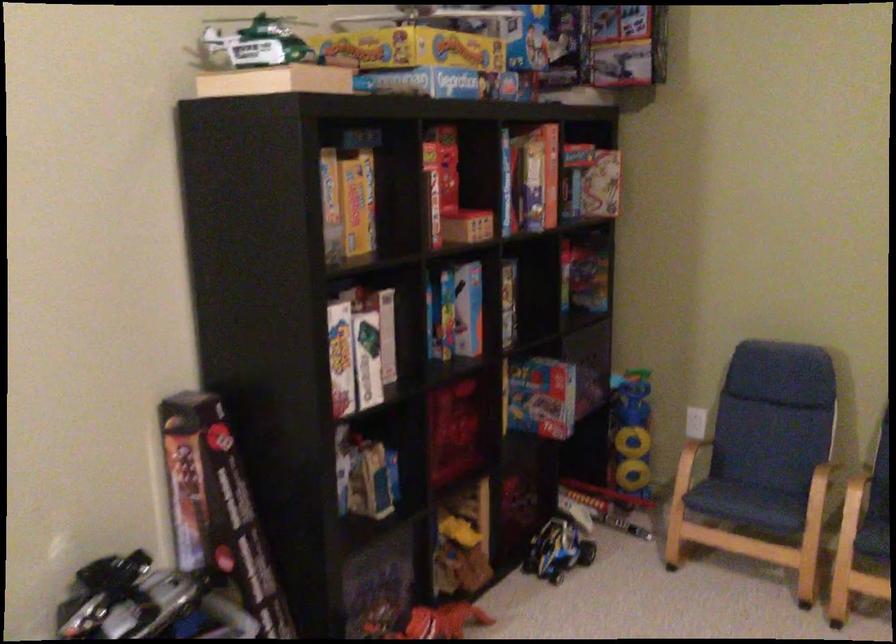
The location [557,550] corresponds to which object?

This point indicates the blue toy car.